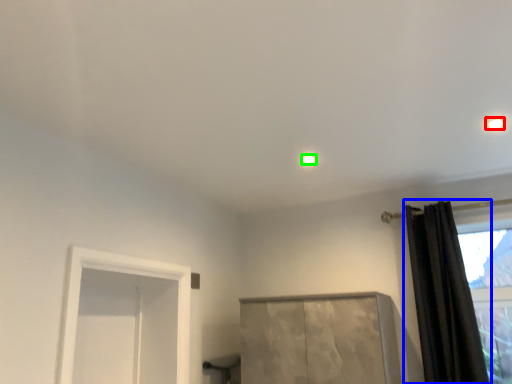
Question: Which is farther away from lighting (highlighted by a red box)? curtain (highlighted by a blue box) or lighting (highlighted by a green box)?

Choices:
 (A) curtain
 (B) lighting

Answer: (A)